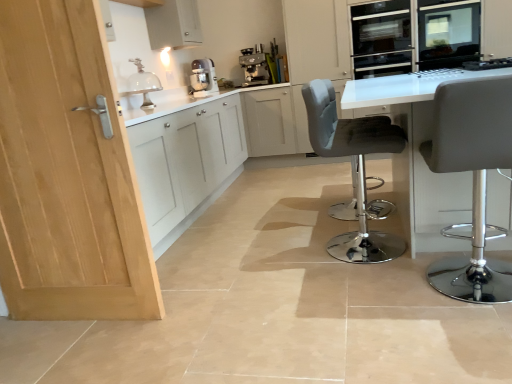
Question: From a real-world perspective, relative to clear glass dome at upper center, is white glossy table at center vertically above or below?

Choices:
 (A) above
 (B) below

Answer: (B)

Question: Considering their positions, is white glossy table at center located in front of or behind clear glass dome at upper center?

Choices:
 (A) front
 (B) behind

Answer: (A)

Question: Which is nearer to the light wood door at left?

Choices:
 (A) velvet grey bar stool at center, marked as the first chair in a back-to-front arrangement
 (B) matte gray stool at right, the 2th chair when ordered from back to front
 (C) matte white mixer at upper center
 (D) clear glass dome at upper center
 (E) black glass oven at upper right

Answer: (A)

Question: Which is farther from the light wood door at left?

Choices:
 (A) white glossy table at center
 (B) satin silver oven at upper right
 (C) matte gray stool at right, which is the 1th chair in front-to-back order
 (D) velvet grey bar stool at center, which is counted as the 2th chair, starting from the front
 (E) black glass oven at upper right

Answer: (B)